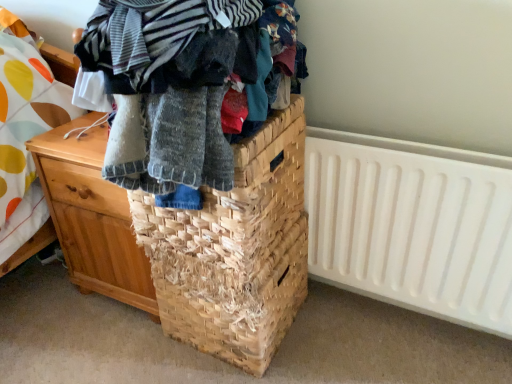
Where is `blank space situated above white plastic radiator at right (from a real-world perspective)`? The width and height of the screenshot is (512, 384). blank space situated above white plastic radiator at right (from a real-world perspective) is located at coordinates (387, 147).